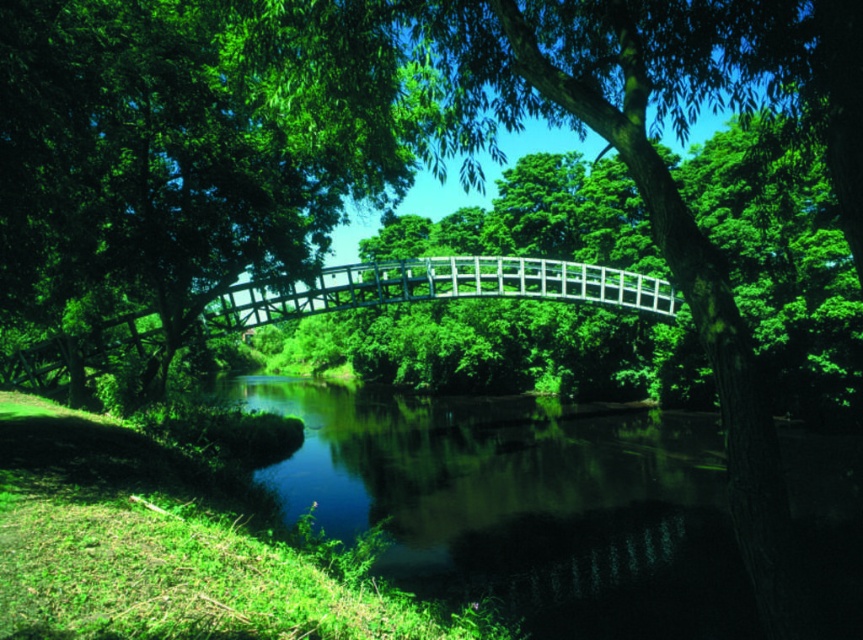
Question: Is green reflective water at center below white wooden bridge at center?

Choices:
 (A) yes
 (B) no

Answer: (A)

Question: Which point is closer to the camera?

Choices:
 (A) (658, 282)
 (B) (830, 628)

Answer: (B)

Question: Among these objects, which one is nearest to the camera?

Choices:
 (A) white wooden bridge at center
 (B) green reflective water at center

Answer: (B)

Question: Is green reflective water at center closer to camera compared to white wooden bridge at center?

Choices:
 (A) yes
 (B) no

Answer: (A)

Question: Which point is farther to the camera?

Choices:
 (A) green reflective water at center
 (B) white wooden bridge at center

Answer: (B)

Question: Does green reflective water at center have a lesser width compared to white wooden bridge at center?

Choices:
 (A) no
 (B) yes

Answer: (A)